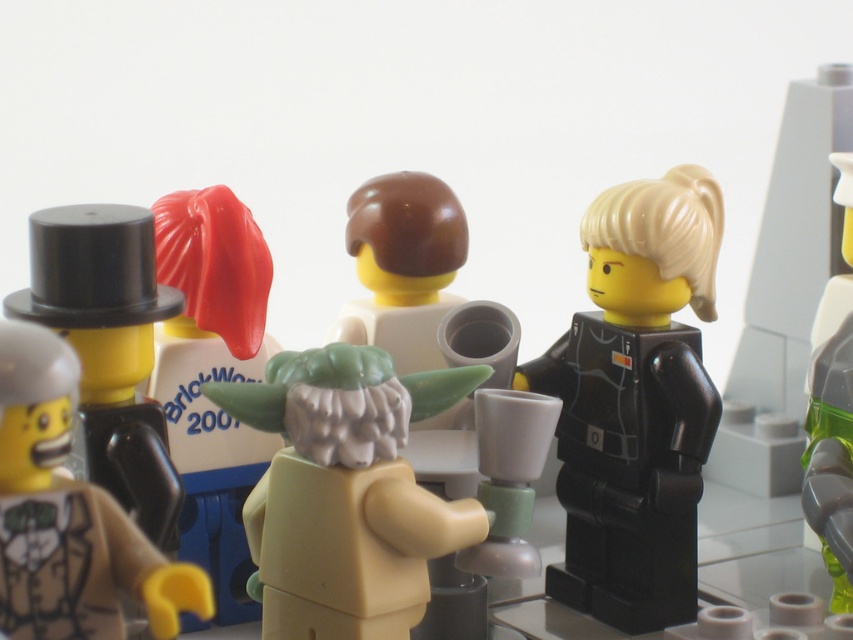
Can you confirm if brown matte head at center is smaller than green translucent plastic minifigure at right?

Actually, brown matte head at center might be larger than green translucent plastic minifigure at right.

Which is in front, point (494, 380) or point (840, 412)?

Point (840, 412)

This screenshot has height=640, width=853. I want to click on brown matte head at center, so click(416, 280).

Who is positioned more to the right, black plastic minifigure at center-right or matte black top hat at left?

black plastic minifigure at center-right

From the picture: Who is positioned more to the left, black plastic minifigure at center-right or matte black top hat at left?

From the viewer's perspective, matte black top hat at left appears more on the left side.

What are the coordinates of `black plastic minifigure at center-right` in the screenshot? It's located at (635, 403).

Between matte black top hat at left and brown matte head at center, which one has less height?

matte black top hat at left is shorter.

Which is in front, point (38, 621) or point (480, 611)?

Positioned in front is point (38, 621).

At what (x,y) coordinates should I click in order to perform the action: click on matte black top hat at left. Please return your answer as a coordinate pair (x, y). This screenshot has width=853, height=640. Looking at the image, I should click on (68, 515).